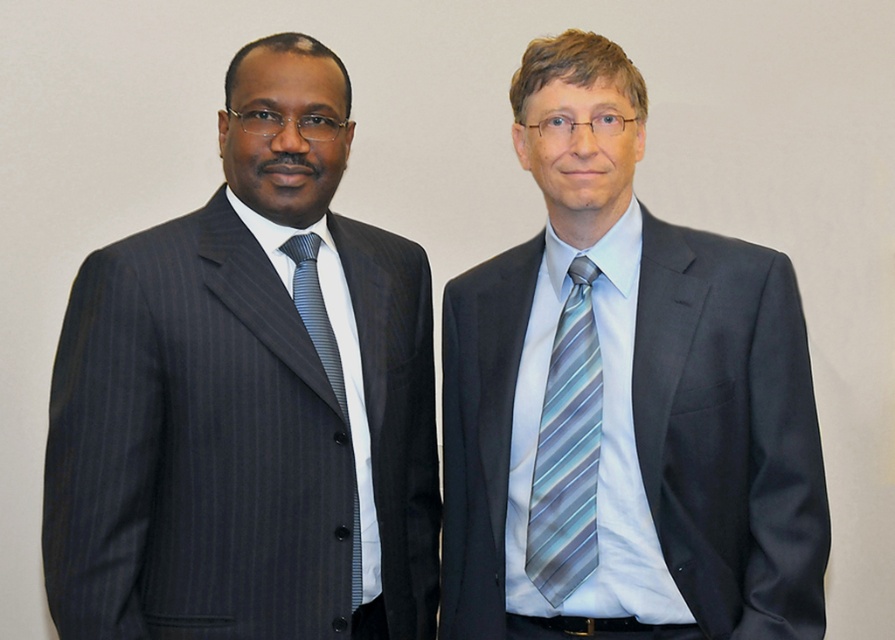
Question: Does pinstriped suit at left have a greater width compared to matte gray suit at center?

Choices:
 (A) yes
 (B) no

Answer: (B)

Question: Among these points, which one is nearest to the camera?

Choices:
 (A) (343, 394)
 (B) (544, 474)

Answer: (A)

Question: Can you confirm if matte gray suit at center is thinner than striped silk tie at left?

Choices:
 (A) no
 (B) yes

Answer: (A)

Question: Is matte gray suit at center wider than striped silk tie at left?

Choices:
 (A) no
 (B) yes

Answer: (B)

Question: Among these objects, which one is farthest from the camera?

Choices:
 (A) matte gray suit at center
 (B) striped silk tie at left

Answer: (B)

Question: Which object appears farthest from the camera in this image?

Choices:
 (A) striped silk tie at left
 (B) pinstriped suit at left
 (C) blue striped tie at center

Answer: (A)